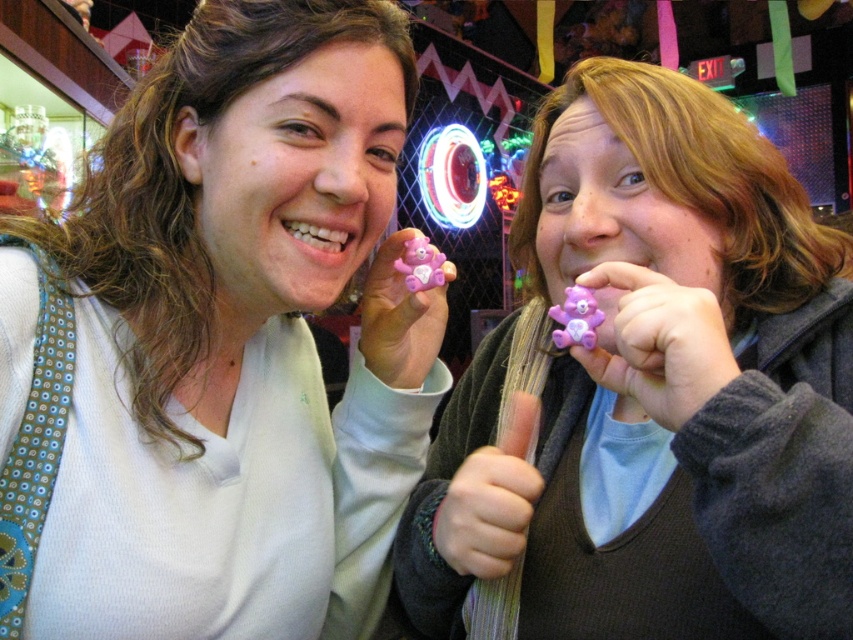
In the scene shown: Does pink matte bear at center have a greater width compared to pink plastic bear at center?

No.

Where is `pink matte bear at center`? The width and height of the screenshot is (853, 640). pink matte bear at center is located at coordinates (218, 346).